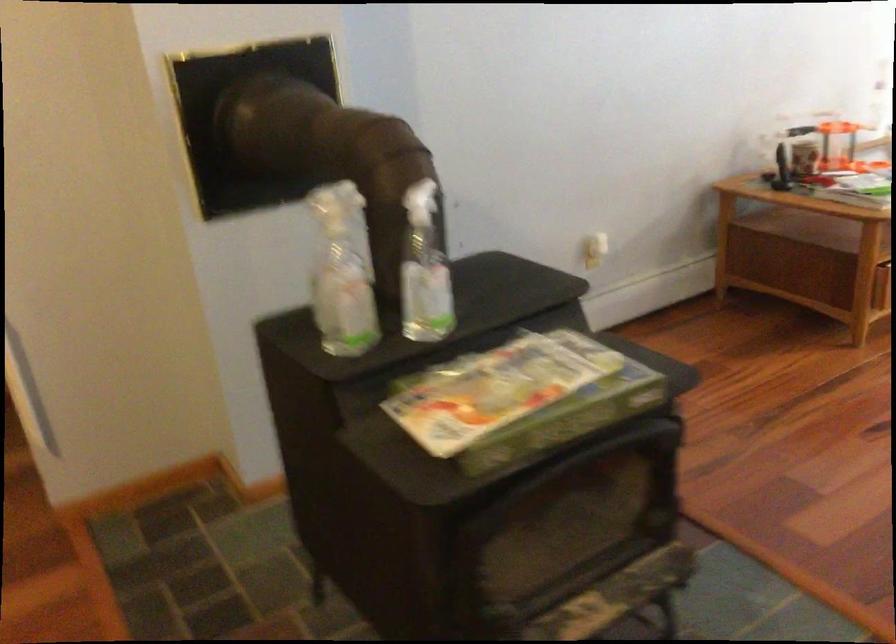
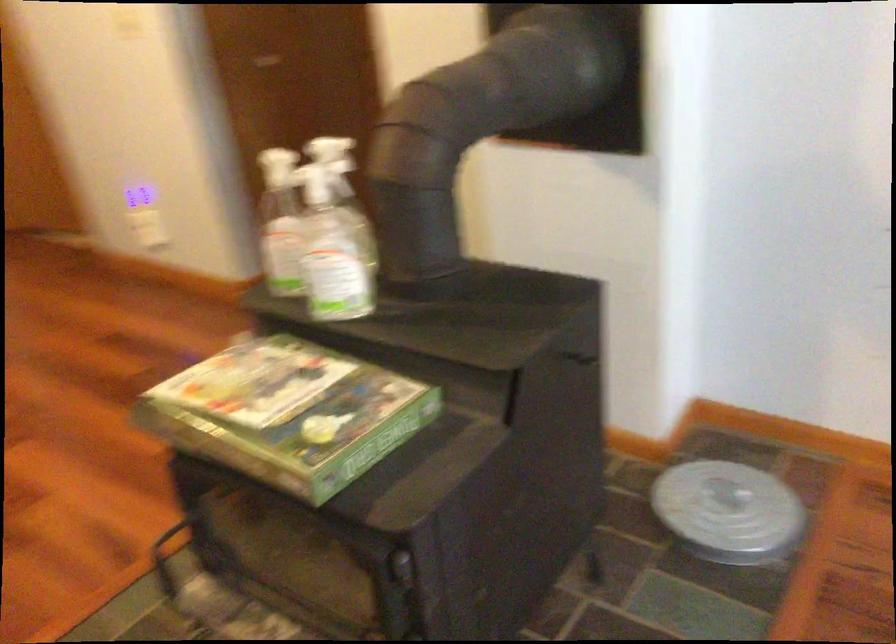
Where in the second image is the point corresponding to pixel 421 204 from the first image?

(314, 184)